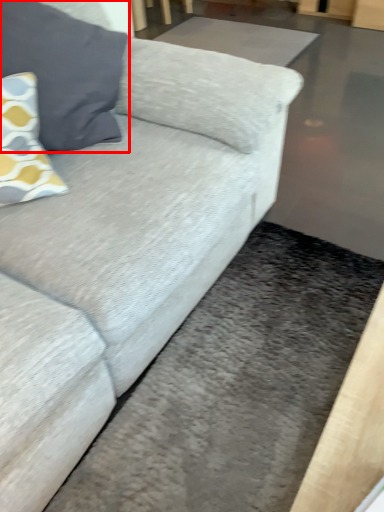
Question: Considering the relative positions of pillow (annotated by the red box) and flat in the image provided, where is pillow (annotated by the red box) located with respect to the staircase?

Choices:
 (A) left
 (B) right

Answer: (A)